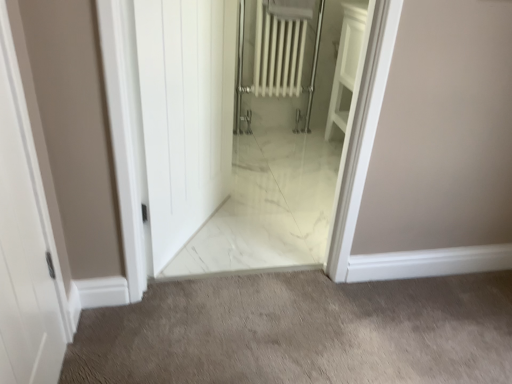
Question: Is white glossy door at center, marked as the 1th door in a back-to-front arrangement, oriented away from white marble elevator at center?

Choices:
 (A) no
 (B) yes

Answer: (B)

Question: Can you confirm if white glossy door at center, the 2th door when ordered from left to right, is shorter than white marble elevator at center?

Choices:
 (A) yes
 (B) no

Answer: (A)

Question: Does white glossy door at center, marked as the 1th door in a back-to-front arrangement, have a larger size compared to white marble elevator at center?

Choices:
 (A) no
 (B) yes

Answer: (B)

Question: Does white glossy door at center, arranged as the 1th door when viewed from the right, come behind white marble elevator at center?

Choices:
 (A) yes
 (B) no

Answer: (A)

Question: Considering the relative positions of white glossy door at center, arranged as the 1th door when viewed from the right, and white marble elevator at center in the image provided, is white glossy door at center, arranged as the 1th door when viewed from the right, to the left of white marble elevator at center from the viewer's perspective?

Choices:
 (A) no
 (B) yes

Answer: (B)

Question: In terms of width, does white matte door at left, the 1th door from the left, look wider or thinner when compared to white glossy door at center, placed as the 2th door when sorted from front to back?

Choices:
 (A) wide
 (B) thin

Answer: (B)

Question: From a real-world perspective, is white matte door at left, the 1th door from the left, positioned above or below white glossy door at center, arranged as the 1th door when viewed from the right?

Choices:
 (A) above
 (B) below

Answer: (B)

Question: From the image's perspective, is white matte door at left, marked as the 1th door in a front-to-back arrangement, positioned above or below white glossy door at center, marked as the 1th door in a back-to-front arrangement?

Choices:
 (A) below
 (B) above

Answer: (A)

Question: In terms of height, does white matte door at left, the 1th door from the left, look taller or shorter compared to white glossy door at center, the 2th door when ordered from left to right?

Choices:
 (A) tall
 (B) short

Answer: (B)

Question: Is white marble floor at center taller or shorter than white matte door at left, the 1th door from the left?

Choices:
 (A) tall
 (B) short

Answer: (B)

Question: In terms of size, does white marble floor at center appear bigger or smaller than white matte door at left, which ranks as the 2th door in right-to-left order?

Choices:
 (A) big
 (B) small

Answer: (A)

Question: From a real-world perspective, is white marble floor at center above or below white matte door at left, which ranks as the 2th door in right-to-left order?

Choices:
 (A) below
 (B) above

Answer: (A)

Question: From the image's perspective, is white marble floor at center above or below white matte door at left, the second door in the back-to-front sequence?

Choices:
 (A) below
 (B) above

Answer: (A)

Question: Based on their sizes in the image, would you say white marble floor at center is bigger or smaller than white marble elevator at center?

Choices:
 (A) big
 (B) small

Answer: (B)

Question: Does point (437, 357) appear closer or farther from the camera than point (272, 145)?

Choices:
 (A) farther
 (B) closer

Answer: (B)